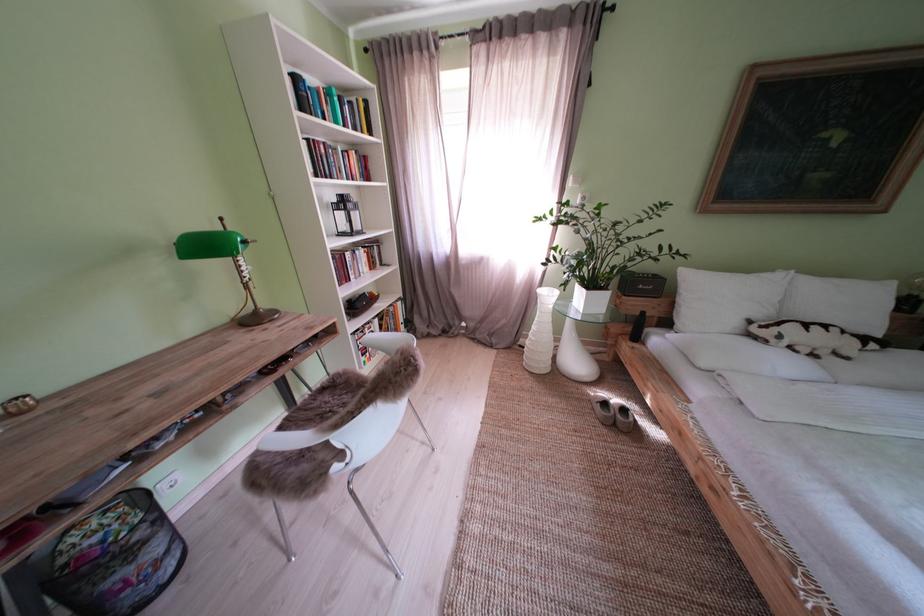
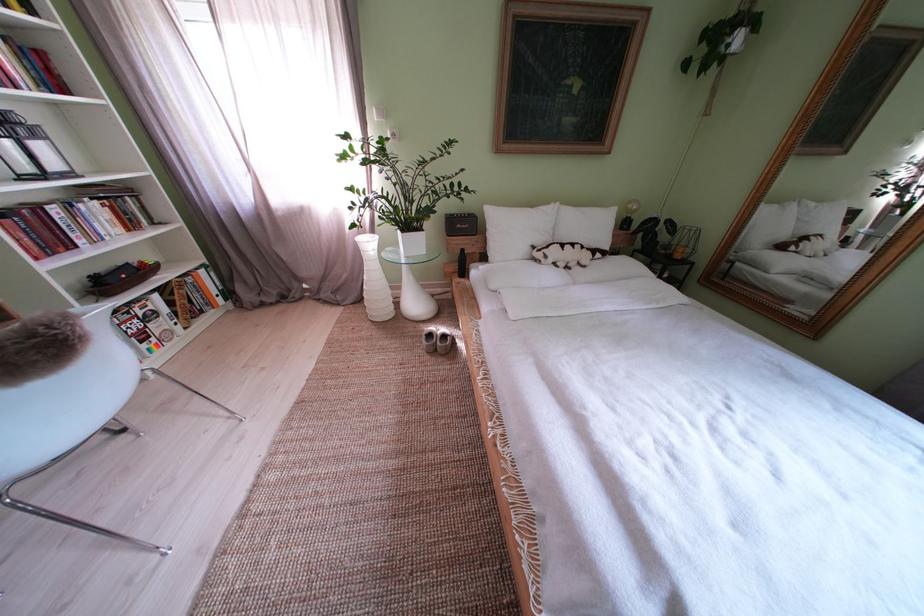
Question: Which direction would the cameraman need to move to produce the second image? Reply with the corresponding letter.

Choices:
 (A) Left
 (B) Right
 (C) Forward
 (D) Backward

Answer: (B)